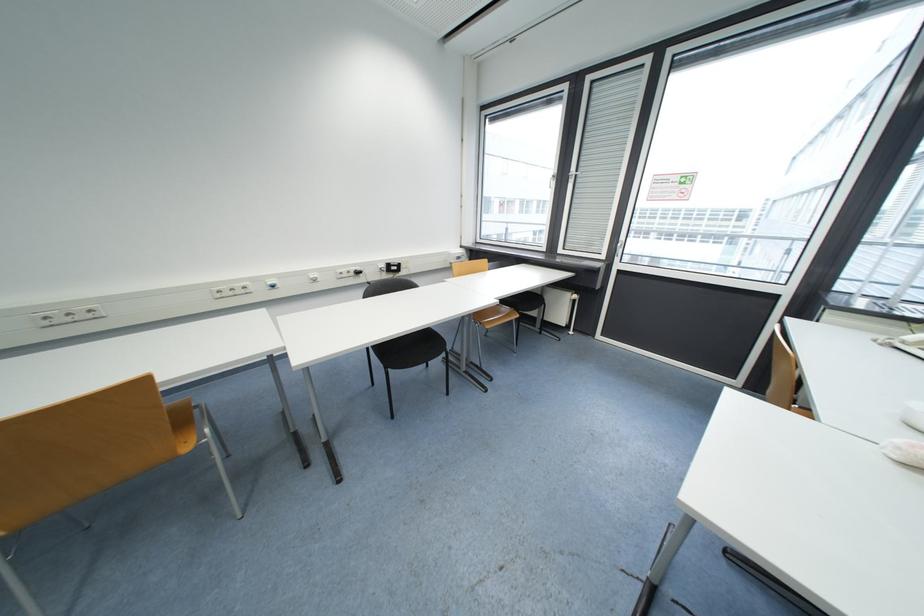
Describe the element at coordinates (415, 349) in the screenshot. I see `the black chair sitting surface` at that location.